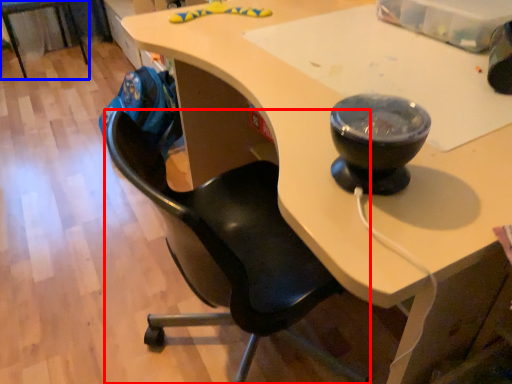
Question: Which point is further to the camera, chair (highlighted by a red box) or chair (highlighted by a blue box)?

Choices:
 (A) chair
 (B) chair

Answer: (B)